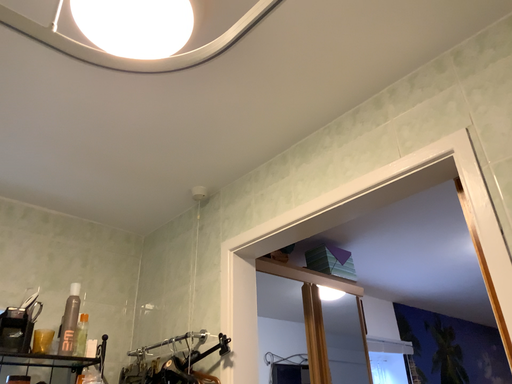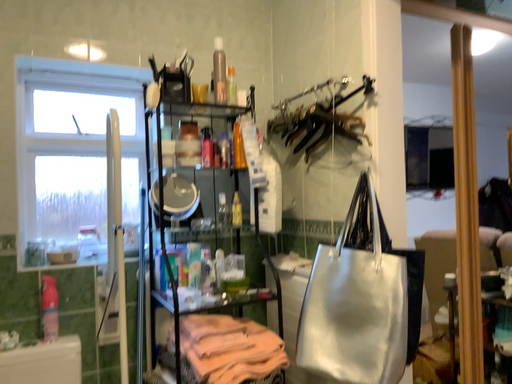
Question: How did the camera likely rotate when shooting the video?

Choices:
 (A) rotated right
 (B) rotated left

Answer: (B)